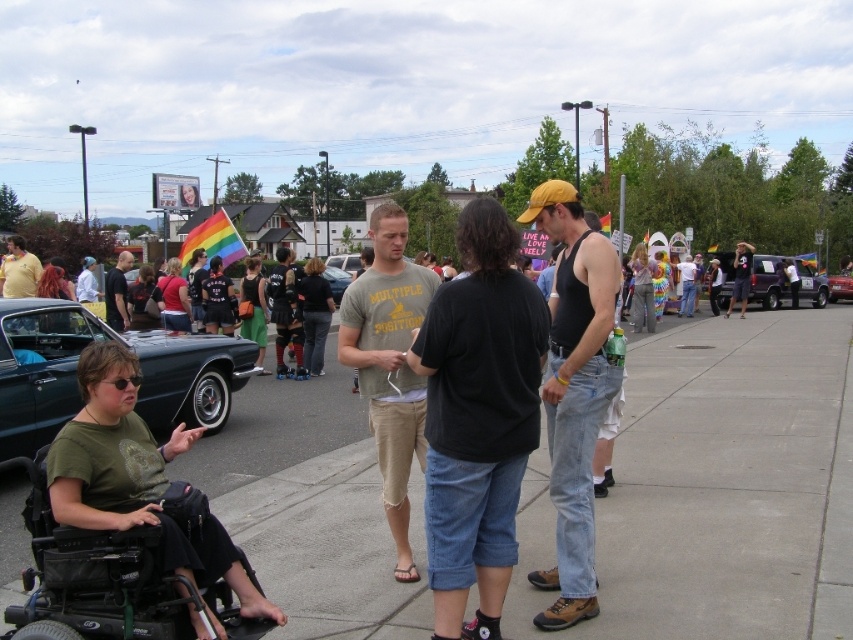
Question: Which of the following is the farthest from the observer?

Choices:
 (A) (32, 273)
 (B) (822, 305)
 (C) (844, 282)
 (D) (415, 372)

Answer: (C)

Question: Which object is positioned farthest from the shiny silver car at center?

Choices:
 (A) shiny black car at left
 (B) matte black shirt at center
 (C) matte black suv at center

Answer: (A)

Question: Can you confirm if concrete at lower left is positioned above matte black suv at center?

Choices:
 (A) yes
 (B) no

Answer: (B)

Question: Can you confirm if shiny black car at left is wider than shiny silver car at center?

Choices:
 (A) no
 (B) yes

Answer: (A)

Question: Which object is the closest to the shiny black car at left?

Choices:
 (A) matte green shirt at lower left
 (B) black plastic wheelchair at lower left
 (C) matte black shirt at center
 (D) concrete at lower left

Answer: (D)

Question: Is matte black tank top at center further to camera compared to black plastic wheelchair at lower left?

Choices:
 (A) yes
 (B) no

Answer: (A)